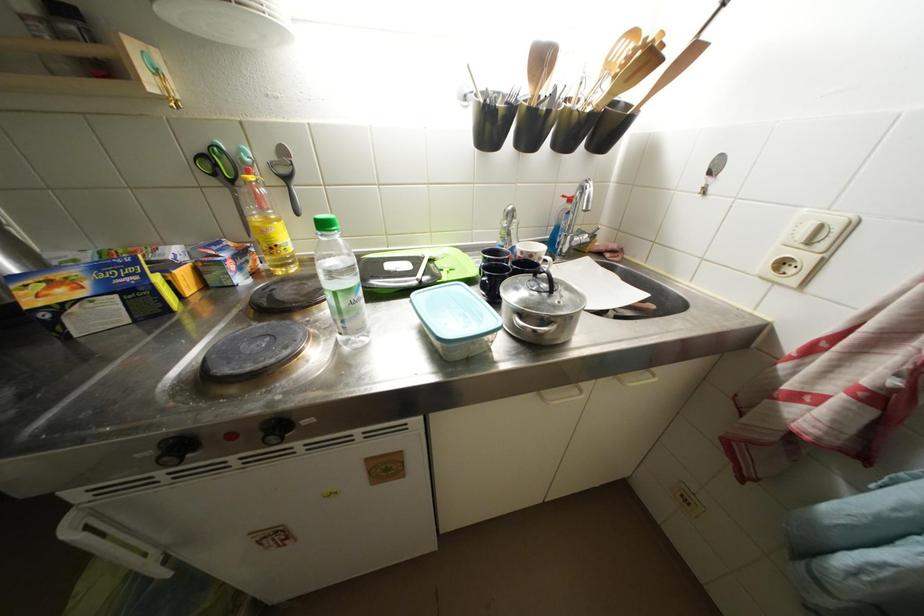
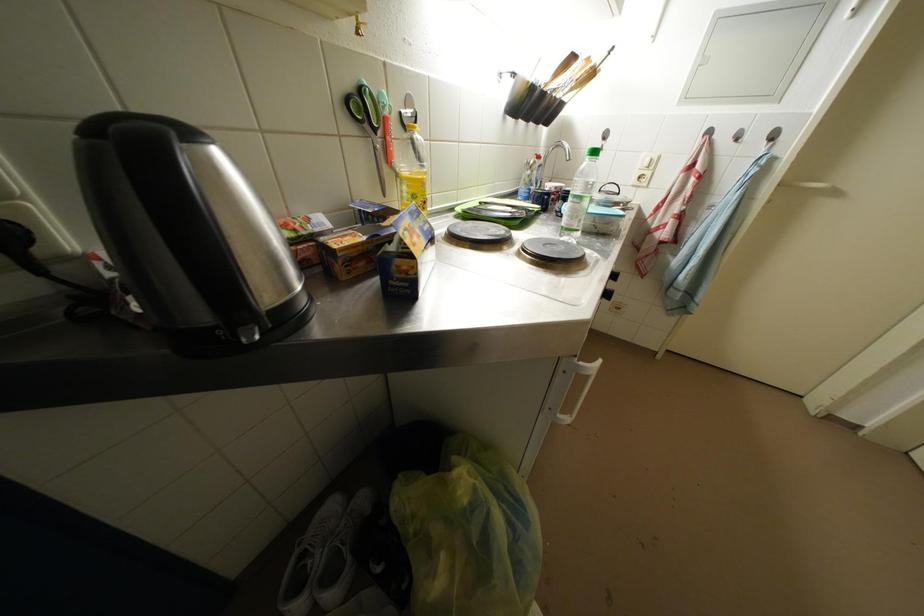
Question: The camera is either moving clockwise (left) or counter-clockwise (right) around the object. The first image is from the beginning of the video and the second image is from the end. Is the camera moving left or right when shooting the video?

Choices:
 (A) Left
 (B) Right

Answer: (A)